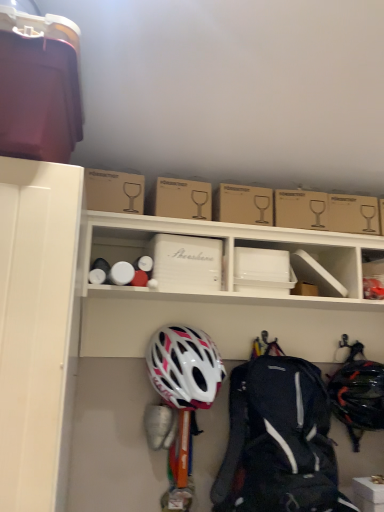
This screenshot has width=384, height=512. What do you see at coordinates (227, 257) in the screenshot? I see `white matte storage box at center` at bounding box center [227, 257].

Image resolution: width=384 pixels, height=512 pixels. What are the coordinates of `white matte storage box at center` in the screenshot? It's located at (227, 257).

What do you see at coordinates (373, 273) in the screenshot? I see `white plastic storage box at upper right, the second storage box ordered from the bottom` at bounding box center [373, 273].

The width and height of the screenshot is (384, 512). Describe the element at coordinates (368, 494) in the screenshot. I see `white matte storage box at lower right, the 2th storage box positioned from the right` at that location.

Where is `matte plastic bin at upper left`? matte plastic bin at upper left is located at coordinates (39, 87).

Measure the distance between point (183,376) and camera.

The depth of point (183,376) is 1.18 meters.

At what (x,y) coordinates should I click in order to perform the action: click on white matte helmet at center, the 2th helmet when ordered from right to left. Please return your answer as a coordinate pair (x, y). The image size is (384, 512). Looking at the image, I should click on (184, 367).

Identify the location of matte black backpack at center. The height and width of the screenshot is (512, 384). (278, 441).

This screenshot has width=384, height=512. In order to click on white matte storage box at center in this screenshot , I will do (227, 257).

Is white matte helmet at center, the 2th helmet when ordered from right to left, looking in the opposite direction of brown cardboard box at upper center, the 2th cardboard box viewed from the right?

No, white matte helmet at center, the 2th helmet when ordered from right to left,'s orientation is not away from brown cardboard box at upper center, the 2th cardboard box viewed from the right.

Is point (213, 357) positioned before point (201, 209)?

No, (213, 357) is behind (201, 209).

From a real-world perspective, which is physically below, white matte helmet at center, marked as the first helmet in a left-to-right arrangement, or brown cardboard box at upper center, which appears as the third cardboard box when viewed from the left?

From a 3D spatial view, white matte helmet at center, marked as the first helmet in a left-to-right arrangement, is below.

Are white matte helmet at center, the 2th helmet when ordered from right to left, and white plastic storage box at upper right, positioned as the second storage box in top-to-bottom order, beside each other?

They are not placed beside each other.

Can you tell me how much white matte helmet at center, marked as the first helmet in a left-to-right arrangement, and white plastic storage box at upper right, positioned as the third storage box in left-to-right order, differ in facing direction?

4.04 degrees separate the facing orientations of white matte helmet at center, marked as the first helmet in a left-to-right arrangement, and white plastic storage box at upper right, positioned as the third storage box in left-to-right order.

Do you think white matte helmet at center, the 2th helmet when ordered from right to left, is within white plastic storage box at upper right, the second storage box ordered from the bottom, or outside of it?

white matte helmet at center, the 2th helmet when ordered from right to left, is spatially situated outside white plastic storage box at upper right, the second storage box ordered from the bottom.

From a real-world perspective, who is located lower, white plastic storage box at center, placed as the 3th storage box when sorted from right to left, or matte plastic bin at upper left?

From a 3D spatial view, white plastic storage box at center, placed as the 3th storage box when sorted from right to left, is below.

From the image's perspective, who appears lower, white plastic storage box at center, placed as the 3th storage box when sorted from right to left, or matte plastic bin at upper left?

white plastic storage box at center, placed as the 3th storage box when sorted from right to left.

Is white plastic storage box at center, the third storage box when ordered from bottom to top, not inside matte plastic bin at upper left?

Yes, white plastic storage box at center, the third storage box when ordered from bottom to top, is located beyond the bounds of matte plastic bin at upper left.

Which is in front, point (191, 400) or point (210, 277)?

The point (210, 277) is closer to the camera.

From a real-world perspective, which helmet is the 1st one underneath the white matte cardboard box at center, which ranks as the 3th cardboard box in right-to-left order? Please provide its 2D coordinates.

[(184, 367)]

Are white matte helmet at center, marked as the first helmet in a left-to-right arrangement, and white matte cardboard box at center, which is the second cardboard box from left to right, making contact?

No, white matte helmet at center, marked as the first helmet in a left-to-right arrangement, is not making contact with white matte cardboard box at center, which is the second cardboard box from left to right.

Considering the relative sizes of white matte helmet at center, the 2th helmet when ordered from right to left, and white matte cardboard box at center, which ranks as the 3th cardboard box in right-to-left order, in the image provided, is white matte helmet at center, the 2th helmet when ordered from right to left, bigger than white matte cardboard box at center, which ranks as the 3th cardboard box in right-to-left order,?

Yes.

Is white plastic storage box at upper right, the 1th storage box positioned from the right, located within brown cardboard box at upper center, the 2th cardboard box viewed from the right?

No.

Is brown cardboard box at upper center, the 2th cardboard box viewed from the right, to the left of white plastic storage box at upper right, positioned as the third storage box in left-to-right order, from the viewer's perspective?

Indeed, brown cardboard box at upper center, the 2th cardboard box viewed from the right, is positioned on the left side of white plastic storage box at upper right, positioned as the third storage box in left-to-right order.

Is brown cardboard box at upper center, the 2th cardboard box viewed from the right, turned away from white plastic storage box at upper right, positioned as the second storage box in top-to-bottom order?

No.

From the image's perspective, starting from the matte plastic bin at upper left, which cardboard box is the 2nd one below? Please provide its 2D coordinates.

[(183, 199)]

From the image's perspective, is matte plastic bin at upper left located above brown cardboard box at upper center, which appears as the third cardboard box when viewed from the left?

Yes, from the image's perspective, matte plastic bin at upper left is over brown cardboard box at upper center, which appears as the third cardboard box when viewed from the left.

Is matte plastic bin at upper left behind brown cardboard box at upper center, the 2th cardboard box viewed from the right?

No, the depth of matte plastic bin at upper left is less than that of brown cardboard box at upper center, the 2th cardboard box viewed from the right.

Can you confirm if matte plastic bin at upper left is smaller than brown cardboard box at upper center, the 2th cardboard box viewed from the right?

No.

Do you think white matte helmet at center, marked as the first helmet in a left-to-right arrangement, is within white matte storage box at lower right, the first storage box from the bottom, or outside of it?

white matte helmet at center, marked as the first helmet in a left-to-right arrangement, lies outside white matte storage box at lower right, the first storage box from the bottom.

From the image's perspective, which is above, white matte helmet at center, marked as the first helmet in a left-to-right arrangement, or white matte storage box at lower right, the 2th storage box positioned from the right?

white matte helmet at center, marked as the first helmet in a left-to-right arrangement.

Who is more distant, white matte helmet at center, the 2th helmet when ordered from right to left, or white matte storage box at lower right, which is the 2th storage box in left-to-right order?

white matte helmet at center, the 2th helmet when ordered from right to left, is further away from the camera.

This screenshot has height=512, width=384. In order to click on the 4th cardboard box located above the white matte helmet at center, marked as the first helmet in a left-to-right arrangement (from a real-world perspective) in this screenshot , I will do `click(183, 199)`.

Find the location of a particular element. storage box that is the 3rd object to the right of the white matte helmet at center, marked as the first helmet in a left-to-right arrangement, starting at the anchor is located at coordinates (373, 273).

Considering their positions, is brown cardboard box at upper center, which appears as the third cardboard box when viewed from the left, positioned closer to white matte helmet at center, marked as the first helmet in a left-to-right arrangement, than matte plastic bin at upper left?

Among the two, brown cardboard box at upper center, which appears as the third cardboard box when viewed from the left, is located nearer to white matte helmet at center, marked as the first helmet in a left-to-right arrangement.

From the image, which object appears to be nearer to matte plastic bin at upper left, brown cardboard box at upper center, placed as the fourth cardboard box when sorted from right to left, or white matte storage box at lower right, which is the 2th storage box in left-to-right order?

Based on the image, brown cardboard box at upper center, placed as the fourth cardboard box when sorted from right to left, appears to be nearer to matte plastic bin at upper left.

Looking at the image, which one is located further to white matte helmet at center, the 2th helmet when ordered from right to left, white matte cardboard box at center, which ranks as the 3th cardboard box in right-to-left order, or white plastic storage box at upper right, positioned as the second storage box in top-to-bottom order?

white plastic storage box at upper right, positioned as the second storage box in top-to-bottom order, is positioned further to the anchor white matte helmet at center, the 2th helmet when ordered from right to left.

Looking at the image, which one is located closer to white matte storage box at center, white matte helmet at center, the 2th helmet when ordered from right to left, or brown cardboard box at upper center, acting as the first cardboard box starting from the right?

brown cardboard box at upper center, acting as the first cardboard box starting from the right, lies closer to white matte storage box at center than the other object.

Considering their positions, is white matte storage box at lower right, the first storage box from the bottom, positioned closer to white matte storage box at center than matte plastic bin at upper left?

The object closer to white matte storage box at center is matte plastic bin at upper left.

Which object lies further to the anchor point matte black backpack at center, black matte helmet at lower right, acting as the 2th helmet starting from the left, or white matte storage box at center?

white matte storage box at center is positioned further to the anchor matte black backpack at center.

Considering their positions, is brown cardboard box at upper center, the 2th cardboard box viewed from the right, positioned closer to white matte storage box at center than white matte cardboard box at center, which ranks as the 3th cardboard box in right-to-left order?

white matte cardboard box at center, which ranks as the 3th cardboard box in right-to-left order, is closer to white matte storage box at center.

Based on their spatial positions, is matte black backpack at center or white plastic storage box at center, placed as the 3th storage box when sorted from right to left, further from white matte storage box at center?

The object further to white matte storage box at center is matte black backpack at center.

Find the location of a particular element. backpack situated between matte plastic bin at upper left and black matte helmet at lower right, acting as the 2th helmet starting from the left, from left to right is located at coordinates (278, 441).

Where is `backpack that lies between brown cardboard box at upper center, placed as the fourth cardboard box when sorted from right to left, and white matte storage box at lower right, the first storage box from the bottom, from top to bottom`? backpack that lies between brown cardboard box at upper center, placed as the fourth cardboard box when sorted from right to left, and white matte storage box at lower right, the first storage box from the bottom, from top to bottom is located at coordinates (278, 441).

The image size is (384, 512). What are the coordinates of `helmet between white plastic storage box at center, placed as the 3th storage box when sorted from right to left, and white plastic storage box at upper right, positioned as the third storage box in left-to-right order` in the screenshot? It's located at (358, 397).

The image size is (384, 512). In order to click on shelf between white matte cardboard box at center, which ranks as the 3th cardboard box in right-to-left order, and white plastic storage box at upper right, positioned as the second storage box in top-to-bottom order, in the horizontal direction in this screenshot , I will do `click(227, 257)`.